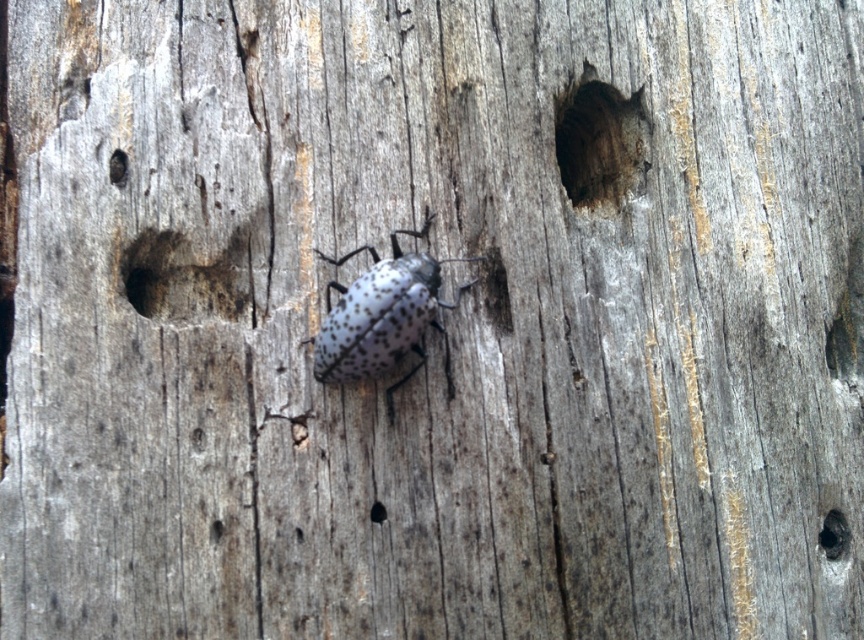
The height and width of the screenshot is (640, 864). What do you see at coordinates (382, 316) in the screenshot?
I see `speckled matte beetle at center` at bounding box center [382, 316].

At what (x,y) coordinates should I click in order to perform the action: click on speckled matte beetle at center. Please return your answer as a coordinate pair (x, y). Image resolution: width=864 pixels, height=640 pixels. Looking at the image, I should click on (382, 316).

Is speckled matte beetle at center bigger than dark wood hole at lower right?

Indeed, speckled matte beetle at center has a larger size compared to dark wood hole at lower right.

Between speckled matte beetle at center and dark wood hole at lower right, which one is positioned higher?

Positioned higher is speckled matte beetle at center.

Is point (356, 308) less distant than point (826, 538)?

Yes, point (356, 308) is closer to viewer.

This screenshot has width=864, height=640. Find the location of `speckled matte beetle at center`. speckled matte beetle at center is located at coordinates (382, 316).

From the picture: Does dark wood hole at upper center have a greater width compared to dark wood hole at lower right?

Indeed, dark wood hole at upper center has a greater width compared to dark wood hole at lower right.

This screenshot has width=864, height=640. In order to click on dark wood hole at upper center in this screenshot , I will do `click(600, 145)`.

Does point (620, 154) come in front of point (833, 516)?

No, (620, 154) is behind (833, 516).

Identify the location of dark wood hole at upper center. The image size is (864, 640). tap(600, 145).